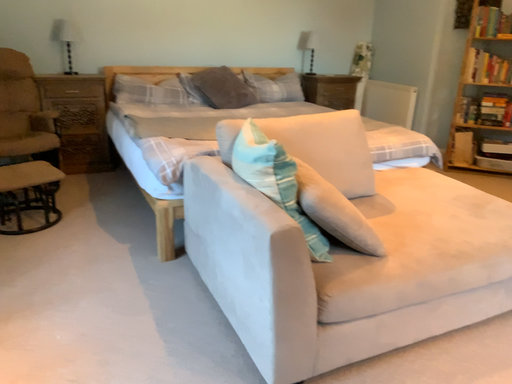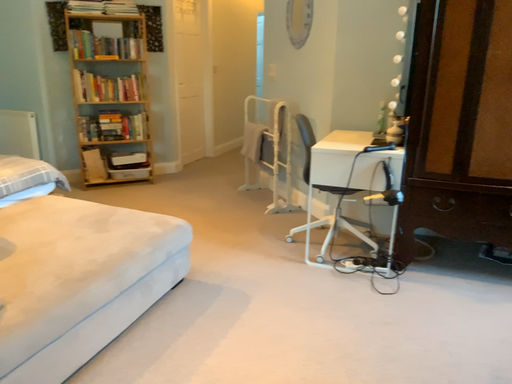
Question: How did the camera likely rotate when shooting the video?

Choices:
 (A) rotated upward
 (B) rotated downward

Answer: (A)